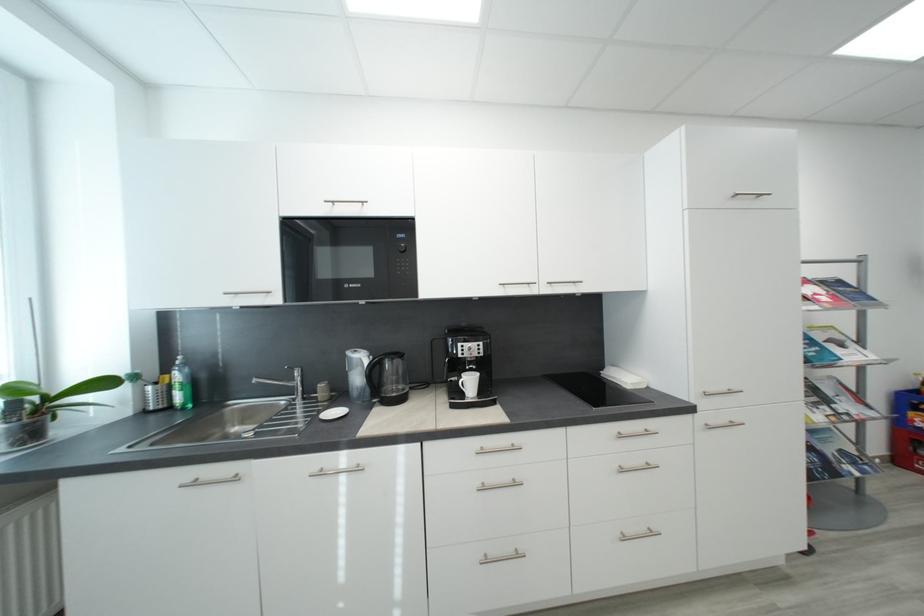
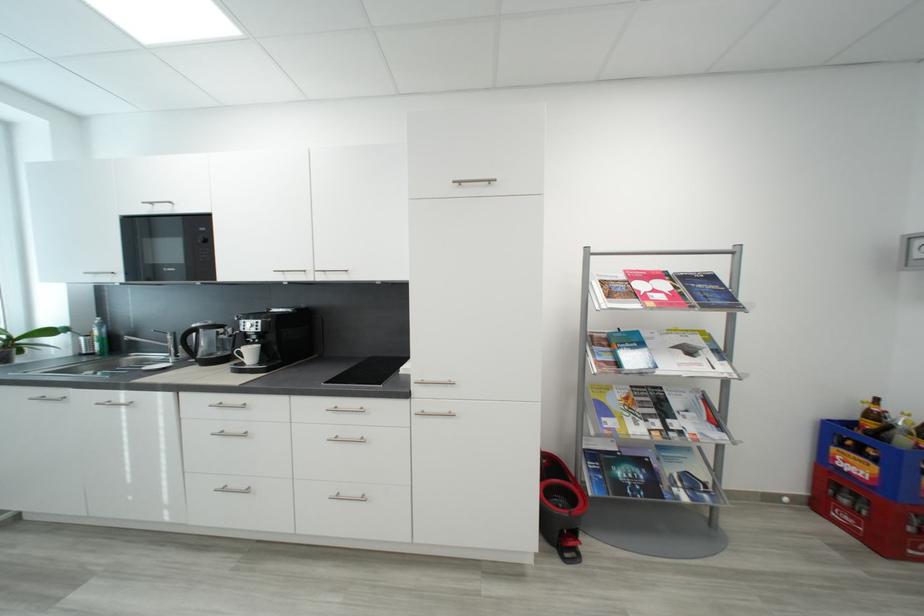
Locate, in the second image, the point that corresponds to point (833, 392) in the first image.

(684, 406)